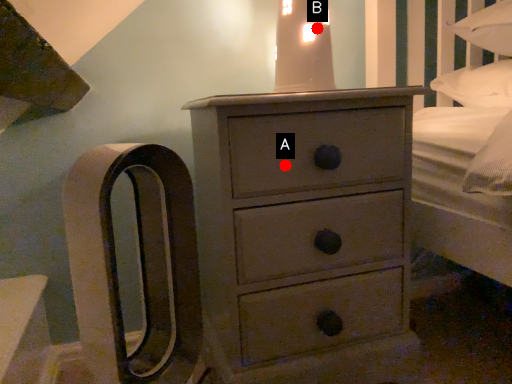
Question: Two points are circled on the image, labeled by A and B beside each circle. Which of the following is the closest to the observer?

Choices:
 (A) A is closer
 (B) B is closer

Answer: (A)